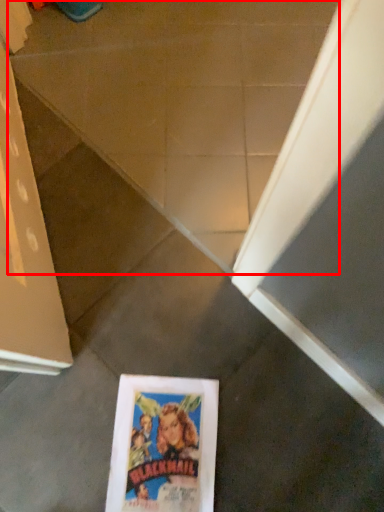
Question: From the image's perspective, what is the correct spatial relationship of concrete (annotated by the red box) in relation to paperback book?

Choices:
 (A) above
 (B) below

Answer: (A)